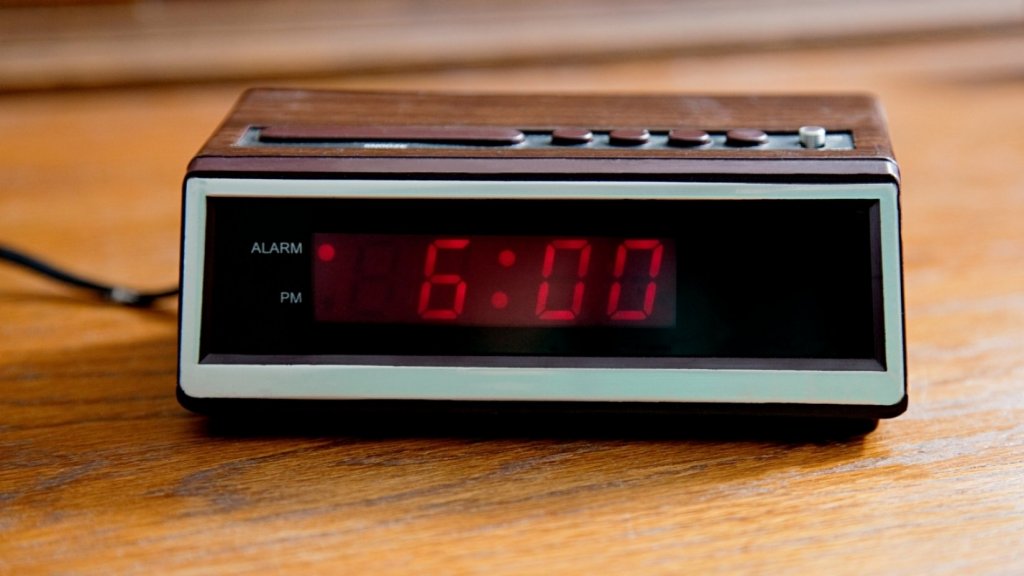
You are a GUI agent. You are given a task and a screenshot of the screen. Output one action in this format:
    pyautogui.click(x=<x>, y=<y>)
    Task: Click on the white 'pm' on left front side of clock below 'alarm' in white text
    
    Given the screenshot: What is the action you would take?
    pyautogui.click(x=289, y=299)